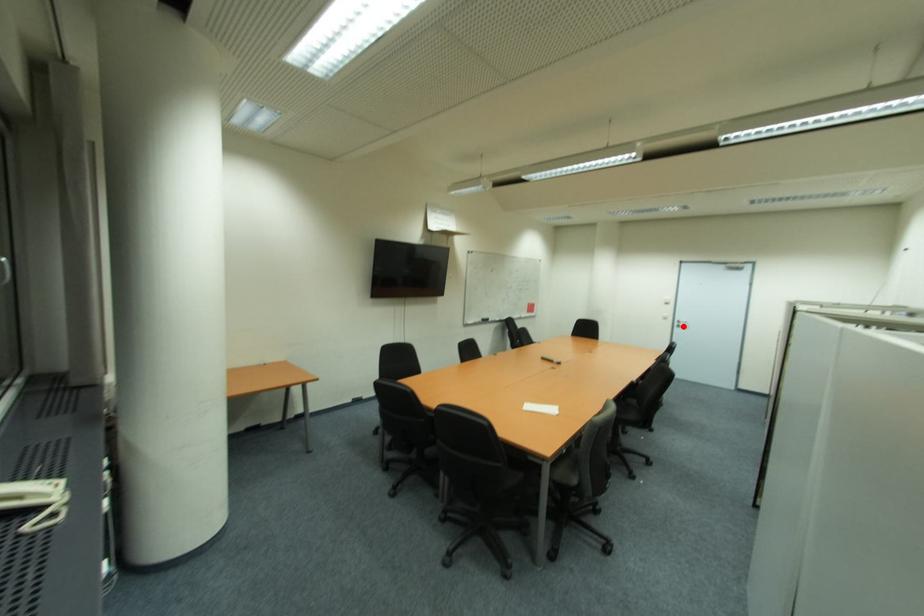
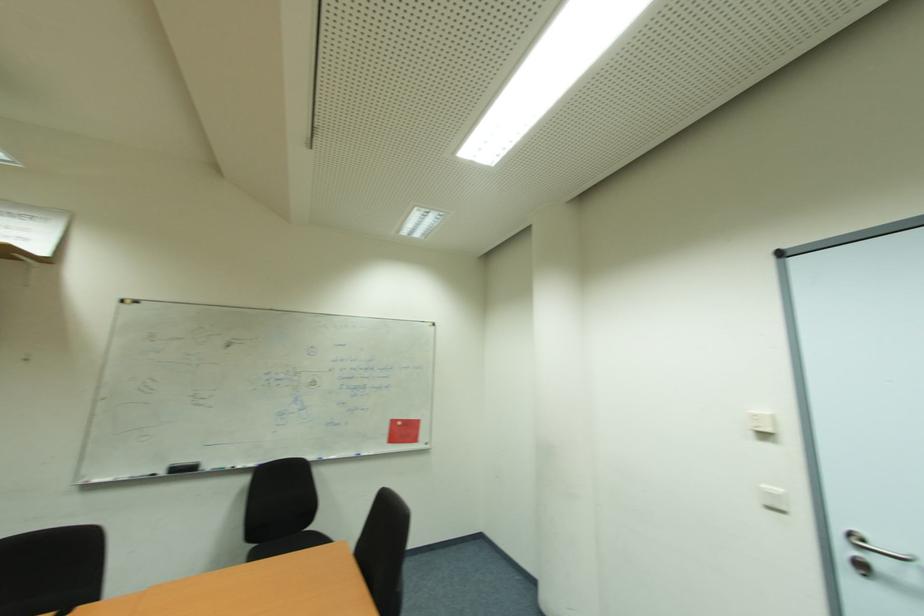
Question: A red point is marked in image1. In image2, is the corresponding 3D point closer to the camera or farther? Reply with the corresponding letter.

Choices:
 (A) The corresponding 3D point is closer.
 (B) The corresponding 3D point is farther.

Answer: (A)